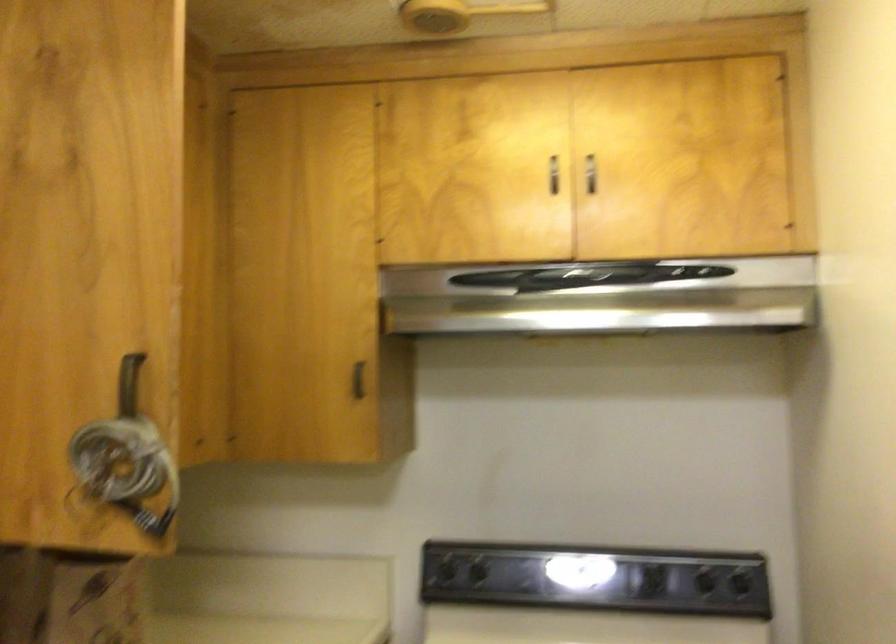
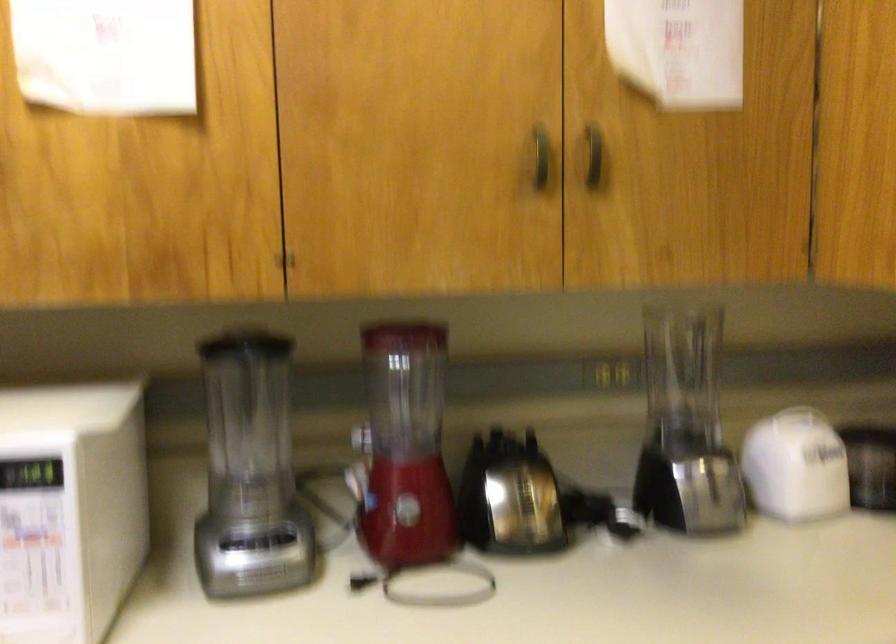
Question: The camera is either moving clockwise (left) or counter-clockwise (right) around the object. The first image is from the beginning of the video and the second image is from the end. Is the camera moving left or right when shooting the video?

Choices:
 (A) Left
 (B) Right

Answer: (B)